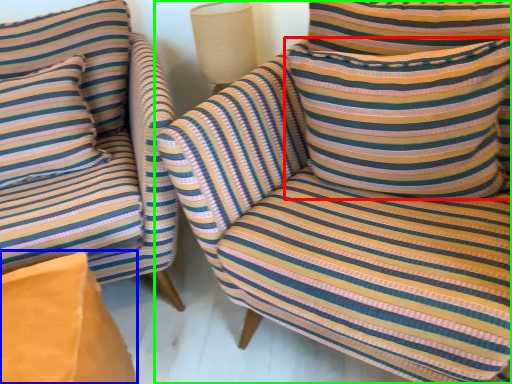
Question: Which is farther away from pillow (highlighted by a red box)? cardboard box (highlighted by a blue box) or chair (highlighted by a green box)?

Choices:
 (A) cardboard box
 (B) chair

Answer: (A)